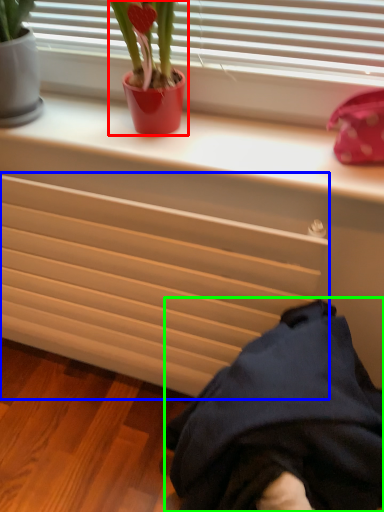
Question: Which object is positioned farthest from houseplant (highlighted by a red box)? Select from radiator (highlighted by a blue box) and clothing (highlighted by a green box).

Choices:
 (A) radiator
 (B) clothing

Answer: (B)